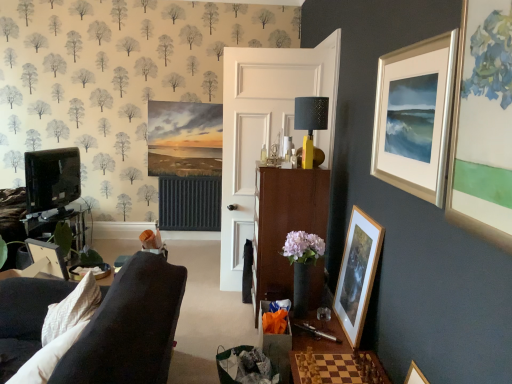
At what (x,y) coordinates should I click in order to perform the action: click on yellow matte/black textured lampshade at center. Please return your answer as a coordinate pair (x, y). The image size is (512, 384). Looking at the image, I should click on (310, 123).

Describe the element at coordinates (310, 123) in the screenshot. I see `yellow matte/black textured lampshade at center` at that location.

Identify the location of white wood door at center. This screenshot has height=384, width=512. (265, 128).

What is the approximate width of wooden chessboard at lower center?

It is 18.08 inches.

What do you see at coordinates (48, 257) in the screenshot?
I see `wooden picture frame at left, the 3th picture frame when ordered from right to left` at bounding box center [48, 257].

This screenshot has width=512, height=384. Identify the location of yellow matte/black textured lampshade at center. (310, 123).

Is wooden chessboard at lower center to the left or to the right of yellow matte/black textured lampshade at center in the image?

wooden chessboard at lower center is to the right of yellow matte/black textured lampshade at center.

Could you measure the distance between wooden chessboard at lower center and yellow matte/black textured lampshade at center?

wooden chessboard at lower center and yellow matte/black textured lampshade at center are 4.56 feet apart from each other.

Is wooden chessboard at lower center thinner than yellow matte/black textured lampshade at center?

No, wooden chessboard at lower center is not thinner than yellow matte/black textured lampshade at center.

Considering the relative sizes of wooden chessboard at lower center and yellow matte/black textured lampshade at center in the image provided, is wooden chessboard at lower center shorter than yellow matte/black textured lampshade at center?

Indeed, wooden chessboard at lower center has a lesser height compared to yellow matte/black textured lampshade at center.

Can you confirm if yellow matte/black textured lampshade at center is bigger than white wood door at center?

No, yellow matte/black textured lampshade at center is not bigger than white wood door at center.

Which is in front, yellow matte/black textured lampshade at center or white wood door at center?

yellow matte/black textured lampshade at center is closer to the camera.

Which is closer, (309, 144) or (319, 80)?

Point (309, 144) appears to be closer to the viewer than point (319, 80).

From a real-world perspective, between yellow matte/black textured lampshade at center and white wood door at center, who is vertically higher?

In real-world perspective, yellow matte/black textured lampshade at center is above.

Which object is closer to the camera taking this photo, wooden picture frame at left, which is the 1th picture frame in left-to-right order, or matte black tv stand at left?

wooden picture frame at left, which is the 1th picture frame in left-to-right order, is in front.

Considering the sizes of wooden picture frame at left, the 3th picture frame when ordered from right to left, and matte black tv stand at left in the image, is wooden picture frame at left, the 3th picture frame when ordered from right to left, wider or thinner than matte black tv stand at left?

Clearly, wooden picture frame at left, the 3th picture frame when ordered from right to left, has less width compared to matte black tv stand at left.

Does wooden picture frame at left, which is the 1th picture frame in left-to-right order, have a larger size compared to matte black tv stand at left?

No.

Is wooden picture frame at left, the second picture frame when ordered from bottom to top, shorter than matte black tv stand at left?

Yes.

Based on the photo, how different are the orientations of wooden cabinet at center and wooden picture frame at lower right, the second picture frame viewed from the right, in degrees?

wooden cabinet at center and wooden picture frame at lower right, the second picture frame viewed from the right, are facing 1.92 degrees away from each other.

Which of these two, wooden cabinet at center or wooden picture frame at lower right, the second picture frame in the left-to-right sequence, is wider?

wooden cabinet at center is wider.

Is point (271, 210) less distant than point (362, 281)?

No.

Is wooden cabinet at center at the right side of wooden picture frame at lower right, the second picture frame viewed from the right?

Incorrect, wooden cabinet at center is not on the right side of wooden picture frame at lower right, the second picture frame viewed from the right.

Considering their positions, is wooden chessboard at lower center located in front of or behind wooden picture frame at lower right, the second picture frame in the left-to-right sequence?

wooden chessboard at lower center is in front of wooden picture frame at lower right, the second picture frame in the left-to-right sequence.

From the picture: From a real-world perspective, which is physically above, wooden chessboard at lower center or wooden picture frame at lower right, the second picture frame viewed from the right?

wooden picture frame at lower right, the second picture frame viewed from the right, is physically above.

Is the surface of wooden chessboard at lower center in direct contact with wooden picture frame at lower right, which is the first picture frame in bottom-to-top order?

wooden chessboard at lower center and wooden picture frame at lower right, which is the first picture frame in bottom-to-top order, are not in contact.

Which is farther, (357, 380) or (338, 298)?

Positioned behind is point (338, 298).

Is wooden picture frame at lower right, which is the first picture frame in bottom-to-top order, directly adjacent to white wood door at center?

No, wooden picture frame at lower right, which is the first picture frame in bottom-to-top order, is not in contact with white wood door at center.

The width and height of the screenshot is (512, 384). What are the coordinates of `the 2nd picture frame positioned below the white wood door at center (from the image's perspective)` in the screenshot? It's located at (357, 274).

From the image's perspective, is wooden picture frame at lower right, the second picture frame viewed from the right, below white wood door at center?

Yes, from the image's perspective, wooden picture frame at lower right, the second picture frame viewed from the right, is below white wood door at center.

Between wooden picture frame at lower right, acting as the 3th picture frame starting from the top, and white wood door at center, which one has larger width?

Wider between the two is white wood door at center.

Which object is closer to the camera taking this photo, wooden chessboard at lower center or wooden cabinet at center?

wooden chessboard at lower center is more forward.

Considering the positions of point (298, 381) and point (306, 225), is point (298, 381) closer or farther from the camera than point (306, 225)?

Point (298, 381) is positioned closer to the camera compared to point (306, 225).

Which is more to the left, wooden chessboard at lower center or wooden cabinet at center?

Positioned to the left is wooden cabinet at center.

The height and width of the screenshot is (384, 512). I want to click on table below the yellow matte/black textured lampshade at center (from a real-world perspective), so [337, 368].

Identify the location of door on the left side of yellow matte/black textured lampshade at center. (265, 128).

Which object lies nearer to the anchor point wooden picture frame at lower right, acting as the 3th picture frame starting from the top, yellow matte/black textured lampshade at center or white wood door at center?

Based on the image, yellow matte/black textured lampshade at center appears to be nearer to wooden picture frame at lower right, acting as the 3th picture frame starting from the top.

Looking at the image, which one is located further to wooden picture frame at lower right, acting as the 3th picture frame starting from the top, wooden chessboard at lower center or silver metallic picture frame at upper right, the first picture frame when ordered from right to left?

silver metallic picture frame at upper right, the first picture frame when ordered from right to left, lies further to wooden picture frame at lower right, acting as the 3th picture frame starting from the top, than the other object.

Which object lies further to the anchor point yellow matte/black textured lampshade at center, wooden chessboard at lower center or silver metallic picture frame at upper right, which ranks as the third picture frame in left-to-right order?

wooden chessboard at lower center is positioned further to the anchor yellow matte/black textured lampshade at center.

From the image, which object appears to be nearer to wooden cabinet at center, yellow matte/black textured lampshade at center or white wood door at center?

yellow matte/black textured lampshade at center lies closer to wooden cabinet at center than the other object.

Estimate the real-world distances between objects in this image. Which object is further from silver metallic picture frame at upper right, the first picture frame when ordered from right to left, wooden cabinet at center or wooden picture frame at lower right, acting as the 3th picture frame starting from the top?

wooden cabinet at center.

When comparing their distances from wooden chessboard at lower center, does wooden picture frame at lower right, the second picture frame viewed from the right, or silver metallic picture frame at upper right, the 1th picture frame viewed from the top, seem further?

silver metallic picture frame at upper right, the 1th picture frame viewed from the top, lies further to wooden chessboard at lower center than the other object.

Considering their positions, is yellow matte/black textured lampshade at center positioned further to matte black tv stand at left than wooden picture frame at lower right, acting as the 3th picture frame starting from the top?

Based on the image, wooden picture frame at lower right, acting as the 3th picture frame starting from the top, appears to be further to matte black tv stand at left.

Based on their spatial positions, is wooden picture frame at lower right, acting as the 3th picture frame starting from the top, or wooden chessboard at lower center further from silver metallic picture frame at upper right, which ranks as the 3th picture frame in bottom-to-top order?

wooden chessboard at lower center is positioned further to the anchor silver metallic picture frame at upper right, which ranks as the 3th picture frame in bottom-to-top order.

Find the location of a particular element. cabinetry between wooden picture frame at left, the 3th picture frame when ordered from right to left, and wooden chessboard at lower center from left to right is located at coordinates (284, 224).

Locate an element on the screen. door situated between wooden picture frame at left, the second picture frame when ordered from bottom to top, and wooden cabinet at center from left to right is located at coordinates (265, 128).

The height and width of the screenshot is (384, 512). I want to click on lamp situated between wooden picture frame at left, the 2th picture frame in the top-to-bottom sequence, and wooden picture frame at lower right, which is the first picture frame in bottom-to-top order, from left to right, so click(310, 123).

Identify the location of lamp situated between matte black tv stand at left and wooden chessboard at lower center from left to right. (310, 123).